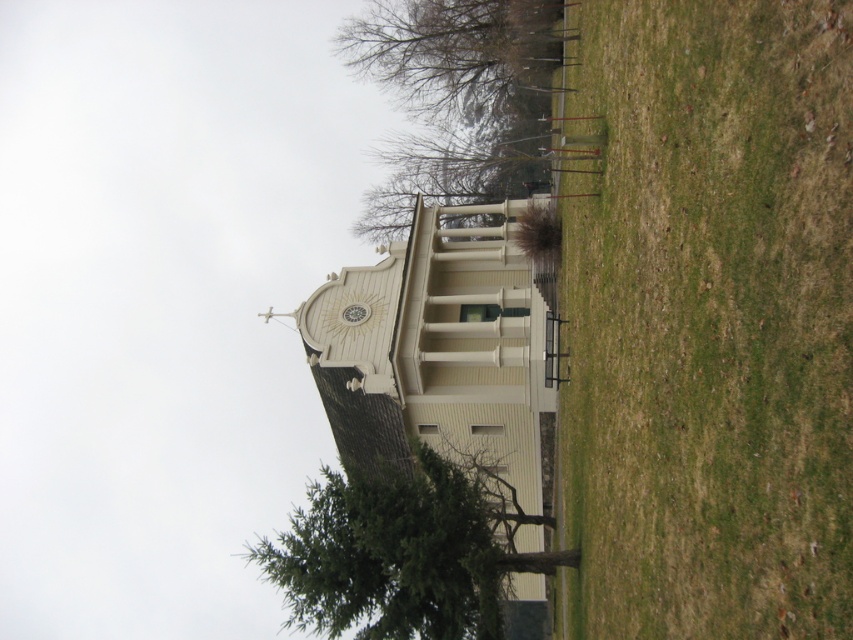
Looking at this image, you are standing at the entrance of the small classical building and want to walk towards the green leafy tree at center. Which direction should you turn to ensure you are facing the green grass at lower right?

The green grass at lower right is to the right of the green leafy tree at center. So, to face the green grass at lower right, you should turn to your right after facing the green leafy tree at center.